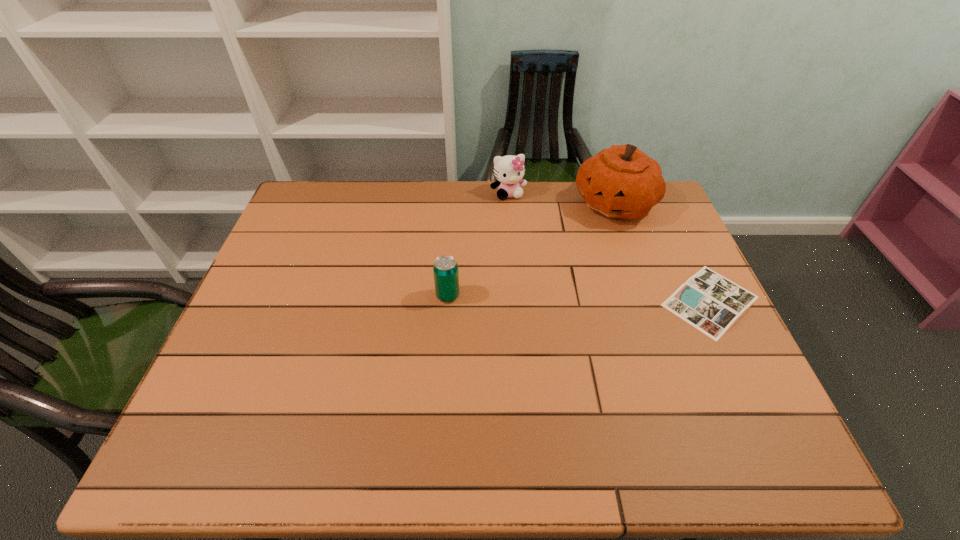
Where is `the leftmost object`? the leftmost object is located at coordinates (445, 269).

Identify the location of beer can. This screenshot has height=540, width=960. (445, 269).

Locate an element on the screen. This screenshot has height=540, width=960. book is located at coordinates (709, 302).

I want to click on pumpkin, so click(x=622, y=182).

Locate an element on the screen. the second object from left to right is located at coordinates (509, 170).

In order to click on the second tallest object in this screenshot , I will do `click(509, 170)`.

Where is `free spot located on the back of the leftmost object`? free spot located on the back of the leftmost object is located at coordinates (450, 254).

Locate an element on the screen. The width and height of the screenshot is (960, 540). free space located on the left of the book is located at coordinates (556, 301).

You are a GUI agent. You are given a task and a screenshot of the screen. Output one action in this format:
    pyautogui.click(x=<x>, y=<y>)
    Task: Click on the vacant space located on the front-facing side of the tallest object
    
    Given the screenshot: What is the action you would take?
    pyautogui.click(x=575, y=292)

Identify the location of free space located 0.070m on the front-facing side of the tallest object. This screenshot has height=540, width=960. (598, 241).